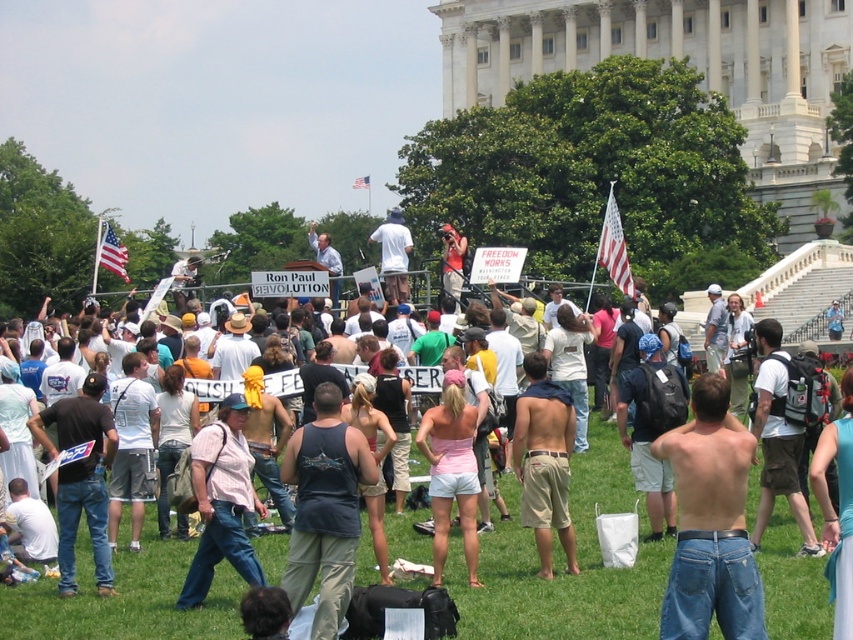
Question: Which point is closer to the camera taking this photo?

Choices:
 (A) (57, 612)
 (B) (543, 461)

Answer: (A)

Question: Which object is positioned closest to the blue jeans at center?

Choices:
 (A) american flag at upper right
 (B) american flag at upper left
 (C) white cotton shirt at center
 (D) tan shorts at center

Answer: (C)

Question: Is white cotton shirt at center positioned in front of blue jeans at center?

Choices:
 (A) no
 (B) yes

Answer: (A)

Question: Can you confirm if blue jeans at center is thinner than american flag at upper right?

Choices:
 (A) no
 (B) yes

Answer: (A)

Question: Which of the following is the farthest from the observer?

Choices:
 (A) (630, 577)
 (B) (693, 426)
 (C) (614, 225)
 (D) (570, 536)

Answer: (C)

Question: Can you confirm if tan shorts at center is thinner than american flag at upper left?

Choices:
 (A) no
 (B) yes

Answer: (B)